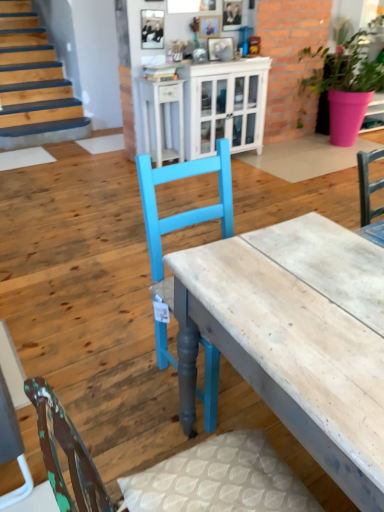
Find the location of `free spot above wooden desk at center (from a real-world perspective)`. free spot above wooden desk at center (from a real-world perspective) is located at coordinates (305, 281).